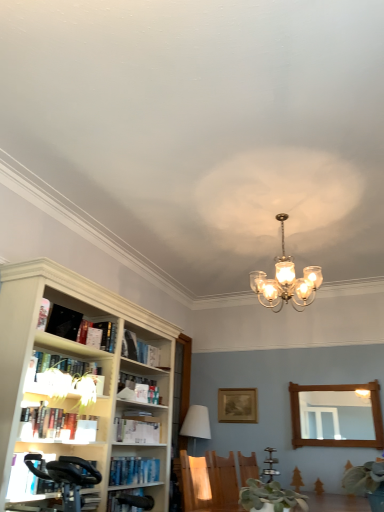
Question: Considering the relative sizes of white matte bookshelf at upper left, arranged as the tenth book when ordered from the bottom, and white paper book at left, which is the 8th book in top-to-bottom order, in the image provided, is white matte bookshelf at upper left, arranged as the tenth book when ordered from the bottom, wider than white paper book at left, which is the 8th book in top-to-bottom order,?

Choices:
 (A) no
 (B) yes

Answer: (A)

Question: Is the surface of white matte bookshelf at upper left, the first book from the top, in direct contact with white paper book at left, which is the 8th book in top-to-bottom order?

Choices:
 (A) yes
 (B) no

Answer: (B)

Question: From a real-world perspective, is white matte bookshelf at upper left, the first book from the top, on white paper book at left, which is the 8th book in top-to-bottom order?

Choices:
 (A) no
 (B) yes

Answer: (B)

Question: From a real-world perspective, is white matte bookshelf at upper left, arranged as the tenth book when ordered from the bottom, under white paper book at left, marked as the third book in a bottom-to-top arrangement?

Choices:
 (A) yes
 (B) no

Answer: (B)

Question: Is white matte bookshelf at upper left, arranged as the tenth book when ordered from the bottom, far away from white paper book at left, marked as the third book in a bottom-to-top arrangement?

Choices:
 (A) yes
 (B) no

Answer: (A)

Question: Considering the relative sizes of white matte bookshelf at upper left, arranged as the tenth book when ordered from the bottom, and white paper book at left, which is the 8th book in top-to-bottom order, in the image provided, is white matte bookshelf at upper left, arranged as the tenth book when ordered from the bottom, thinner than white paper book at left, which is the 8th book in top-to-bottom order,?

Choices:
 (A) yes
 (B) no

Answer: (A)

Question: Is wooden chair at lower center smaller than wooden mirror at right?

Choices:
 (A) yes
 (B) no

Answer: (B)

Question: From a real-world perspective, is wooden chair at lower center below wooden mirror at right?

Choices:
 (A) yes
 (B) no

Answer: (A)

Question: Considering the relative sizes of wooden chair at lower center and wooden mirror at right in the image provided, is wooden chair at lower center bigger than wooden mirror at right?

Choices:
 (A) yes
 (B) no

Answer: (A)

Question: Does wooden chair at lower center have a lesser width compared to wooden mirror at right?

Choices:
 (A) yes
 (B) no

Answer: (B)

Question: From the image's perspective, is wooden chair at lower center beneath wooden mirror at right?

Choices:
 (A) no
 (B) yes

Answer: (A)

Question: Would you consider wooden chair at lower center to be distant from wooden mirror at right?

Choices:
 (A) no
 (B) yes

Answer: (B)

Question: Is black matte bookshelf at upper left, the ninth book in the bottom-to-top sequence, positioned behind hardcover book at left, arranged as the 4th book when viewed from the top?

Choices:
 (A) yes
 (B) no

Answer: (B)